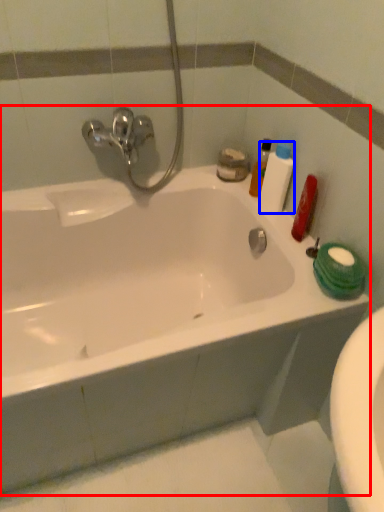
Question: Among these objects, which one is nearest to the camera, bathtub (highlighted by a red box) or toiletry (highlighted by a blue box)?

Choices:
 (A) bathtub
 (B) toiletry

Answer: (A)